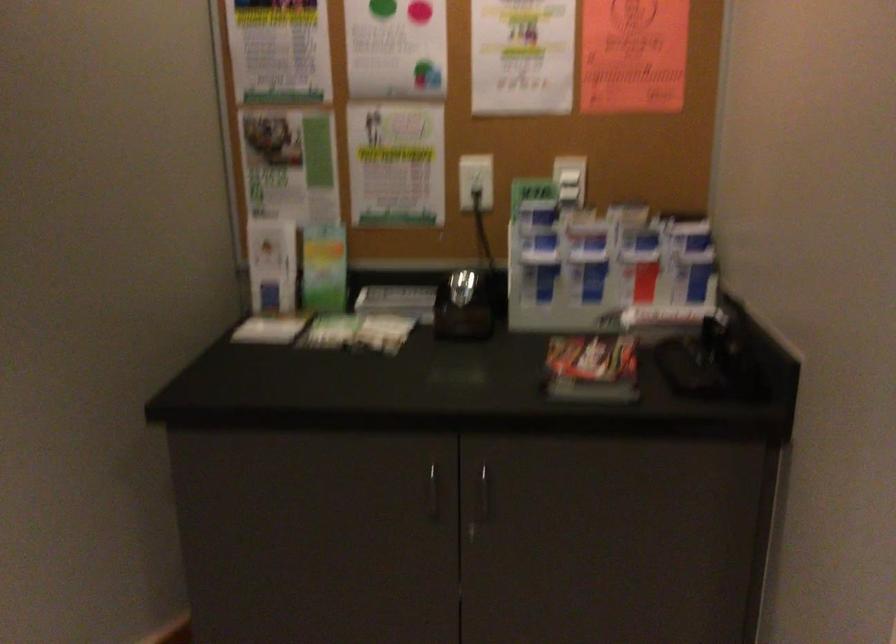
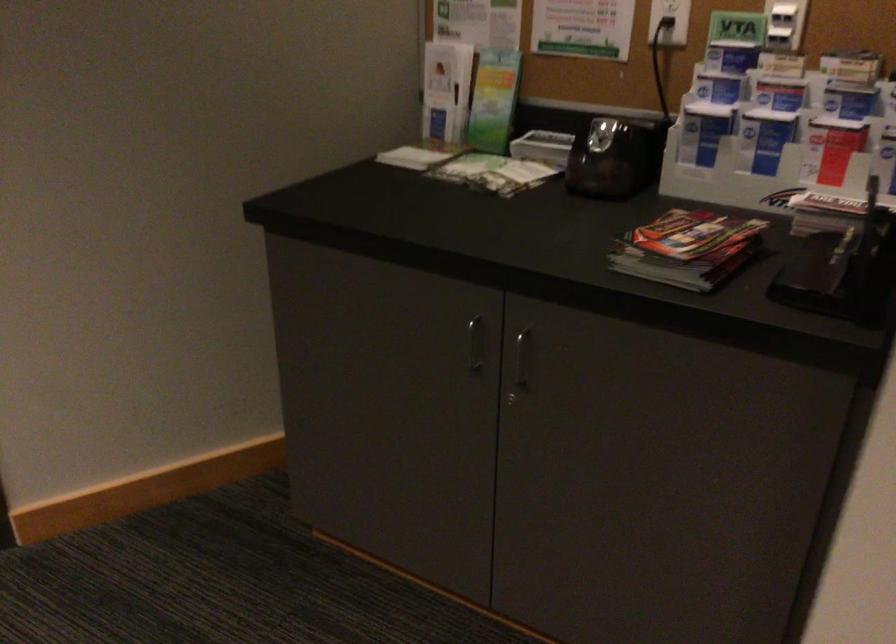
The point at (597, 370) is marked in the first image. Where is the corresponding point in the second image?

(687, 249)